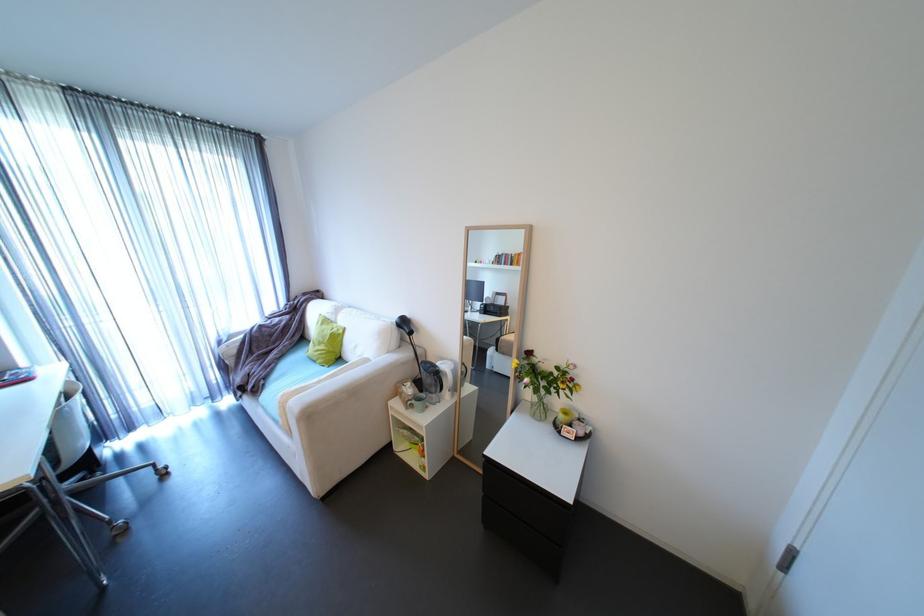
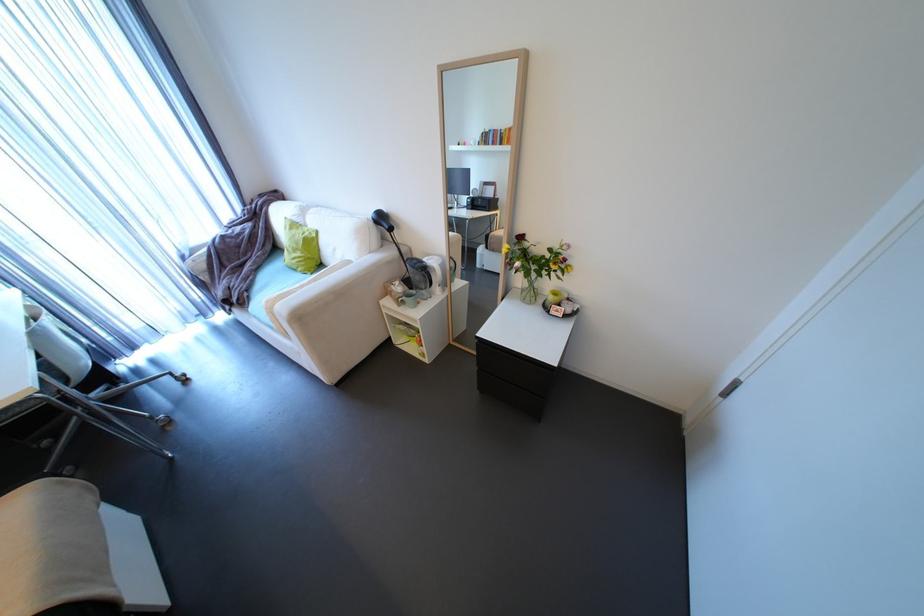
In the second image, find the point that corresponds to point 418,394 in the first image.

(407, 292)